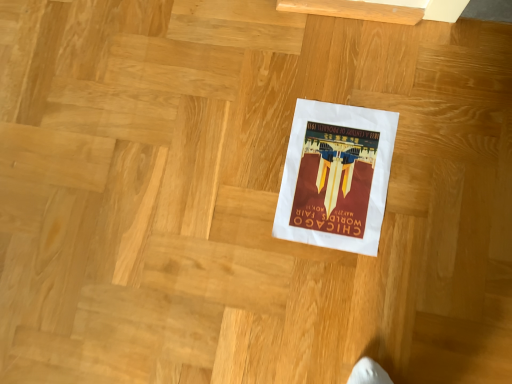
You are a GUI agent. You are given a task and a screenshot of the screen. Output one action in this format:
    pyautogui.click(x=<x>, y=<y>)
    Task: Click on the vacant area that is situated to the right of white paper poster at center
    The image size is (512, 384).
    Given the screenshot: What is the action you would take?
    pos(434,120)